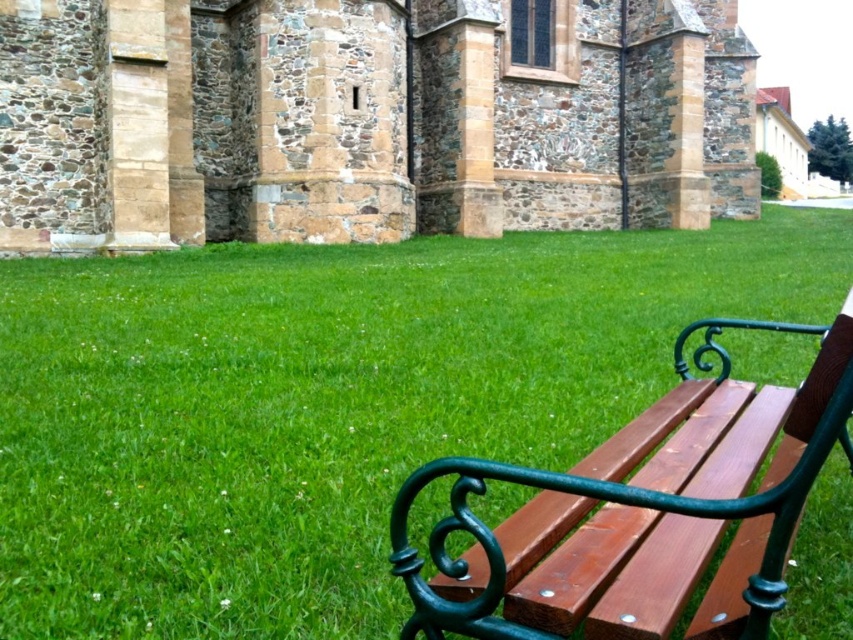
Who is higher up, green grass at center or wooden bench at right?

Positioned higher is green grass at center.

Between point (248, 531) and point (585, 588), which one is positioned behind?

Positioned behind is point (248, 531).

Which is in front, point (354, 406) or point (428, 616)?

Point (428, 616) is more forward.

Where is `green grass at center`? This screenshot has height=640, width=853. green grass at center is located at coordinates (328, 404).

Is green grass at center in front of stone textured church at center?

Yes, green grass at center is closer to the viewer.

Is point (146, 566) in front of point (222, 148)?

Yes, point (146, 566) is closer to viewer.

Does point (184, 564) come farther from viewer compared to point (347, 220)?

No.

Locate an element on the screen. Image resolution: width=853 pixels, height=640 pixels. green grass at center is located at coordinates (328, 404).

Which is more to the left, stone textured church at center or wooden bench at right?

Positioned to the left is stone textured church at center.

Can you confirm if stone textured church at center is positioned to the right of wooden bench at right?

Incorrect, stone textured church at center is not on the right side of wooden bench at right.

Between point (3, 138) and point (582, 472), which one is positioned in front?

Point (582, 472) is in front.

Identify the location of stone textured church at center. Image resolution: width=853 pixels, height=640 pixels. (366, 120).